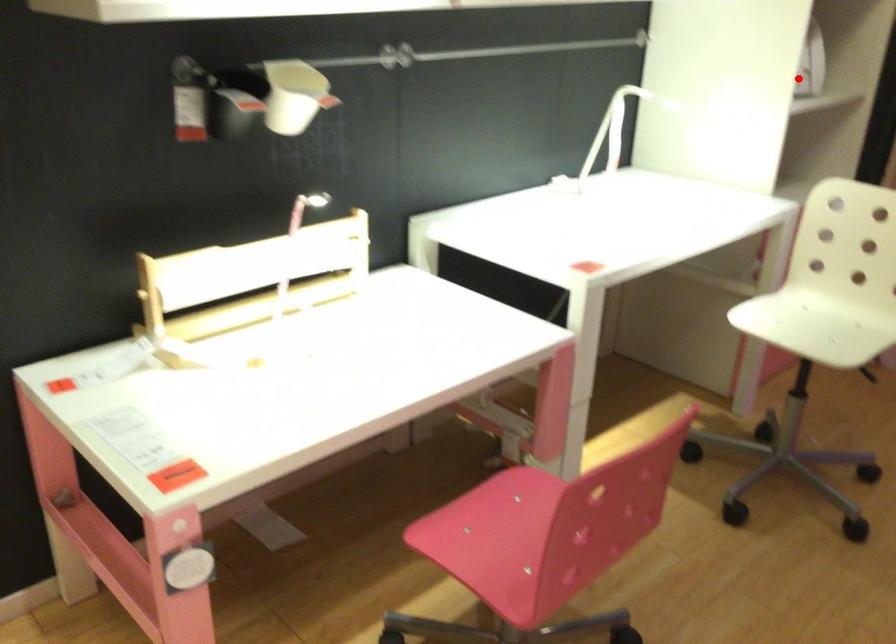
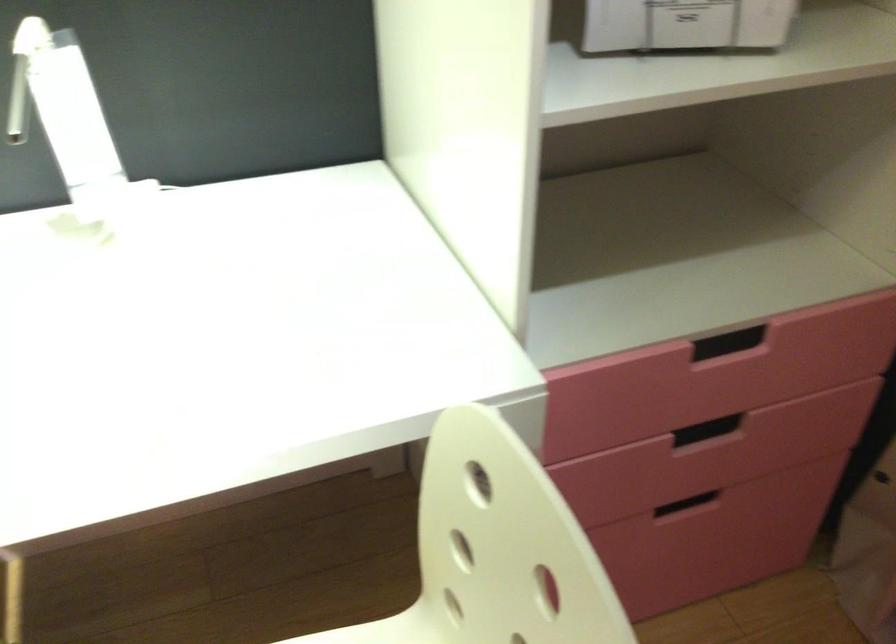
Question: I am providing you with two images of the same scene from different viewpoints. In image1, a red point is highlighted. Considering the same 3D point in image2, which of the following is correct?

Choices:
 (A) It is closer
 (B) It is farther

Answer: (A)